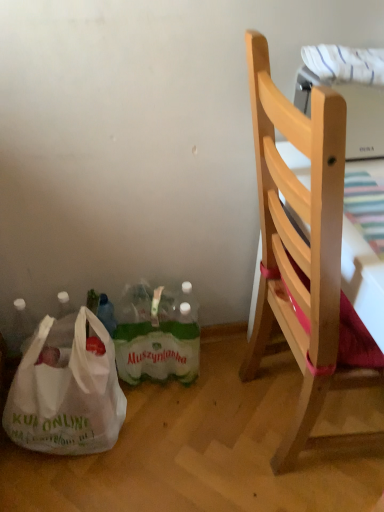
Locate an element on the screen. The image size is (384, 512). spots to the right of white plastic bag at lower left is located at coordinates (156, 439).